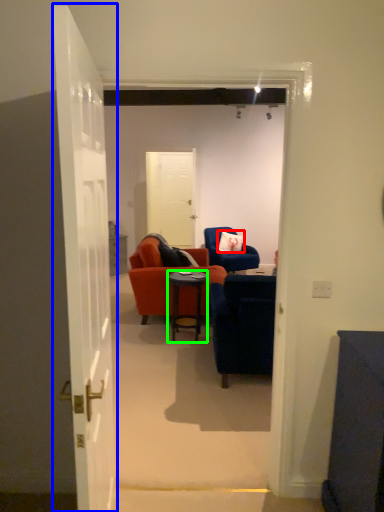
Question: Estimate the real-world distances between objects in this image. Which object is closer to pillow (highlighted by a red box), door (highlighted by a blue box) or desk (highlighted by a green box)?

Choices:
 (A) door
 (B) desk

Answer: (B)